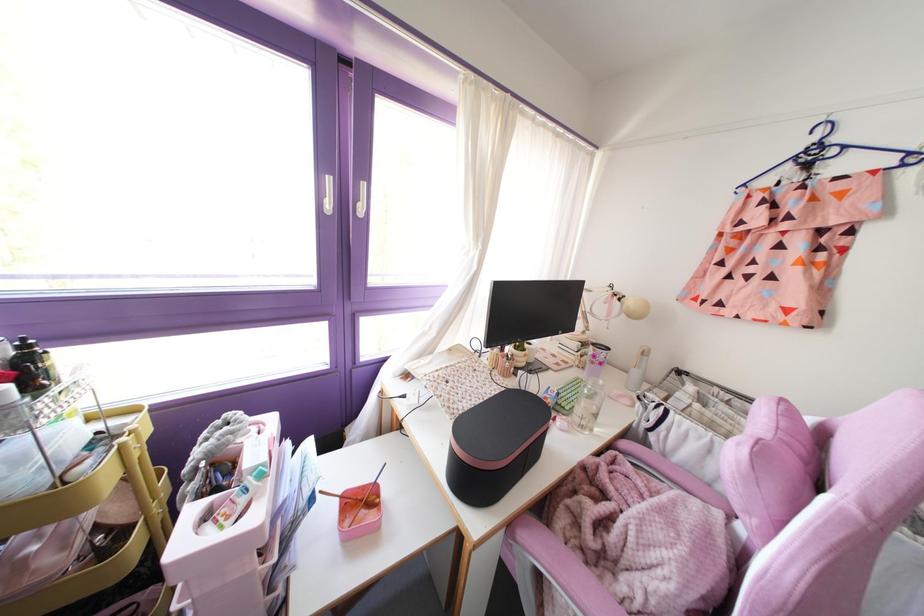
The height and width of the screenshot is (616, 924). Describe the element at coordinates (327, 195) in the screenshot. I see `the white window handle` at that location.